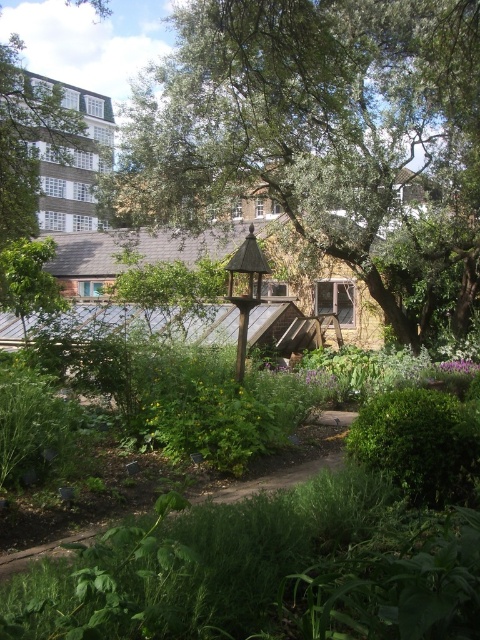
Question: Estimate the real-world distances between objects in this image. Which object is farther from the brown dirt path at center?

Choices:
 (A) green leafy tree at center
 (B) wooden gazebo at center

Answer: (A)

Question: Which of the following is the closest to the observer?

Choices:
 (A) click(324, 58)
 (B) click(226, 499)
 (C) click(261, 268)

Answer: (B)

Question: Is green leafy tree at center further to camera compared to brown dirt path at center?

Choices:
 (A) no
 (B) yes

Answer: (B)

Question: Is green leafy tree at center further to the viewer compared to brown dirt path at center?

Choices:
 (A) no
 (B) yes

Answer: (B)

Question: Can you confirm if brown dirt path at center is thinner than wooden gazebo at center?

Choices:
 (A) yes
 (B) no

Answer: (B)

Question: Which object is farther from the camera taking this photo?

Choices:
 (A) brown dirt path at center
 (B) wooden gazebo at center

Answer: (B)